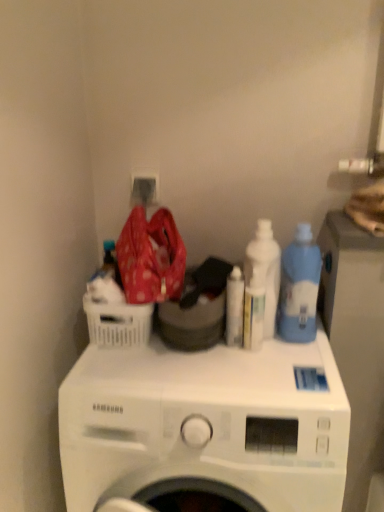
Locate an element on the screen. Image resolution: width=384 pixels, height=512 pixels. free spot in front of white plastic bottle at center is located at coordinates (259, 381).